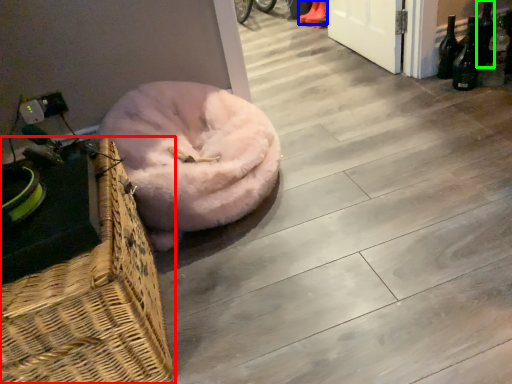
Question: Which object is positioned farthest from picnic basket (highlighted by a red box)? Select from footwear (highlighted by a blue box) and bottle (highlighted by a green box).

Choices:
 (A) footwear
 (B) bottle

Answer: (A)